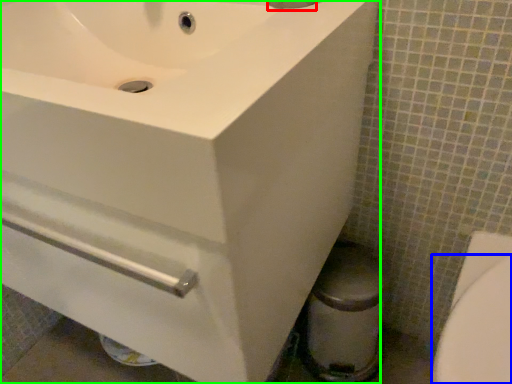
Question: Which is farther away from plumbing fixture (highlighted by a red box)? bidet (highlighted by a blue box) or sink (highlighted by a green box)?

Choices:
 (A) bidet
 (B) sink

Answer: (A)